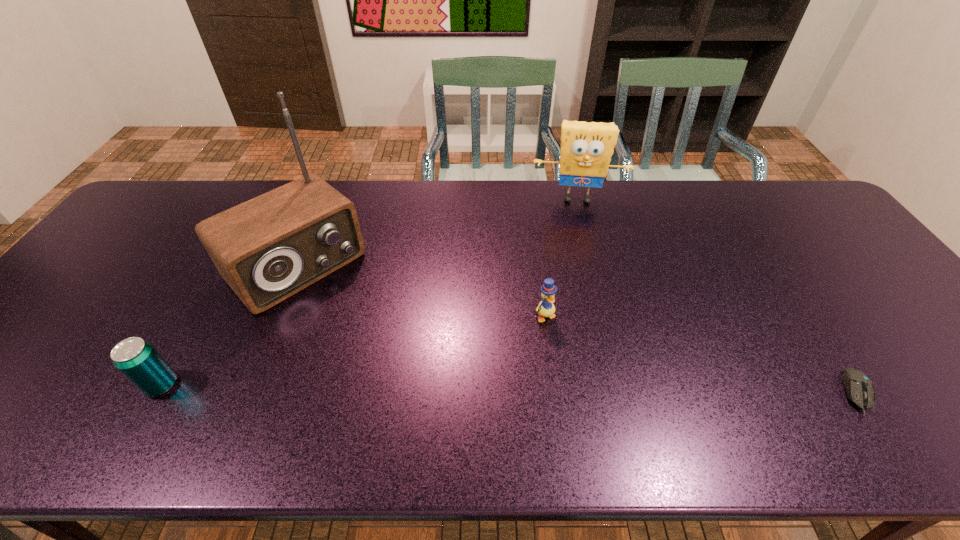
At what (x,y) coordinates should I click in order to perform the action: click on blank region between the beer can and the computer mouse. Please return your answer as a coordinate pair (x, y). Image resolution: width=960 pixels, height=540 pixels. Looking at the image, I should click on (510, 389).

At what (x,y) coordinates should I click in order to perform the action: click on free space between the rightmost object and the beer can. Please return your answer as a coordinate pair (x, y). Image resolution: width=960 pixels, height=540 pixels. Looking at the image, I should click on (510, 389).

You are a GUI agent. You are given a task and a screenshot of the screen. Output one action in this format:
    pyautogui.click(x=<x>, y=<y>)
    Task: Click on the free area in between the farthest object and the beer can
    
    Given the screenshot: What is the action you would take?
    pyautogui.click(x=370, y=292)

Locate an element on the screen. The width and height of the screenshot is (960, 540). free space between the rightmost object and the duckling is located at coordinates (701, 355).

At what (x,y) coordinates should I click in order to perform the action: click on unoccupied area between the duckling and the beer can. Please return your answer as a coordinate pair (x, y). Looking at the image, I should click on (353, 350).

This screenshot has width=960, height=540. I want to click on empty space that is in between the duckling and the farthest object, so click(561, 257).

Image resolution: width=960 pixels, height=540 pixels. Identify the location of free spot between the radio receiver and the duckling. (420, 291).

Locate an element on the screen. This screenshot has height=540, width=960. free space between the farthest object and the beer can is located at coordinates (370, 292).

Find the location of a particular element. The width and height of the screenshot is (960, 540). the third closest object to the shortest object is located at coordinates (267, 249).

The image size is (960, 540). What are the coordinates of `object that stands as the fourth closest to the duckling` in the screenshot? It's located at (135, 358).